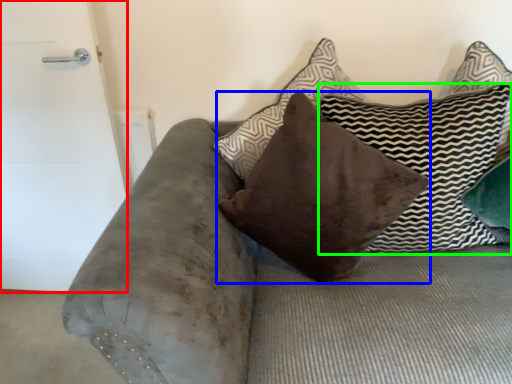
Question: Which object is the closest to the door (highlighted by a red box)? Choose among these: pillow (highlighted by a blue box) or pillow (highlighted by a green box).

Choices:
 (A) pillow
 (B) pillow

Answer: (A)